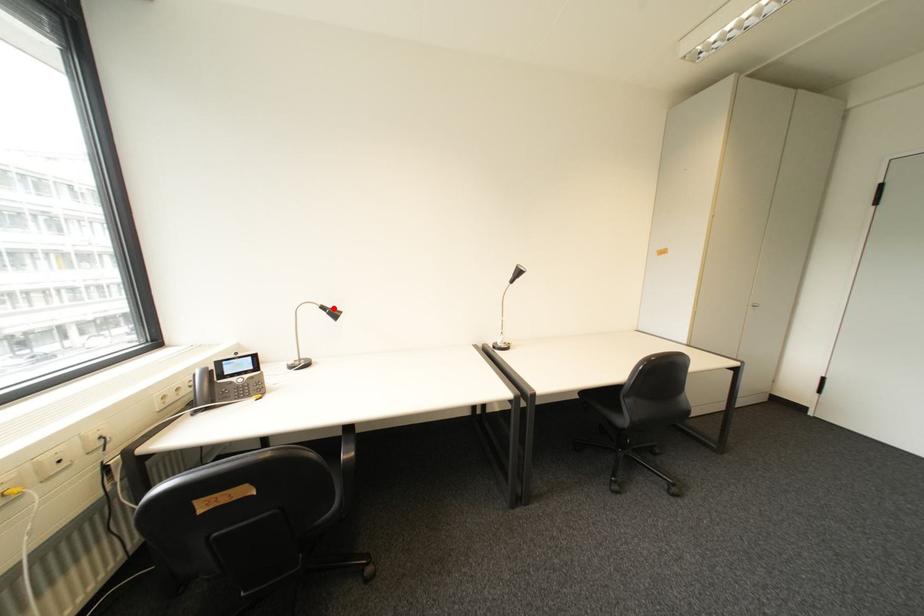
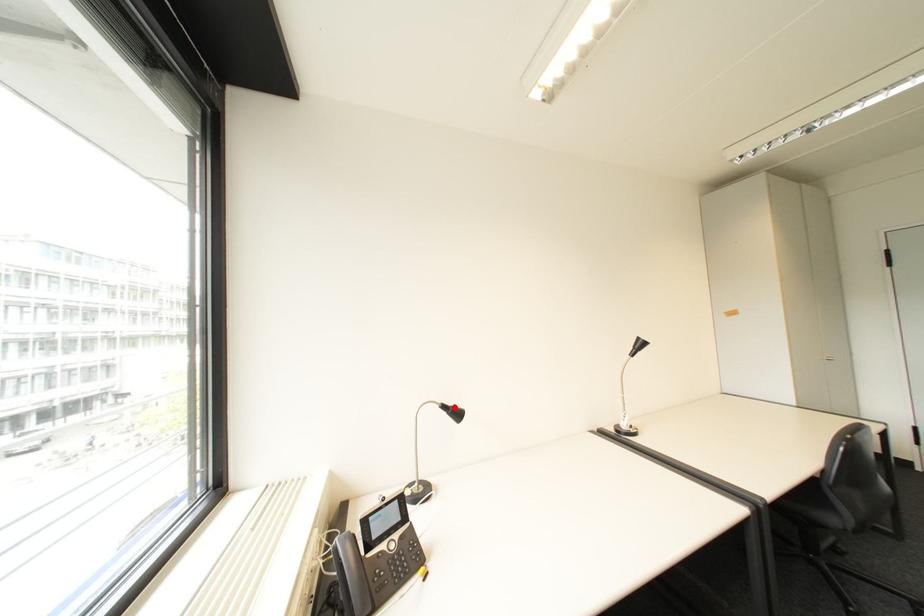
I am providing you with two images of the same scene from different viewpoints. A red point is marked on the first image and another point is marked on the second image. Do the highlighted points in image1 and image2 indicate the same real-world spot?

Yes